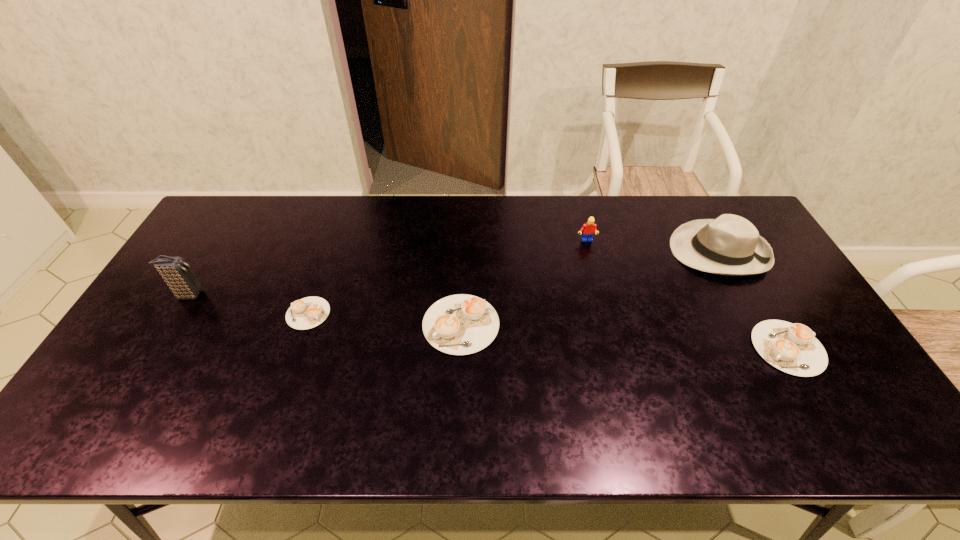
Please determine a free point for an extra cappuccino to ensure balance. Please provide its 2D coordinates. Your answer should be formatted as a tuple, i.e. [(x, y)], where the tuple contains the x and y coordinates of a point satisfying the conditions above.

[(621, 336)]